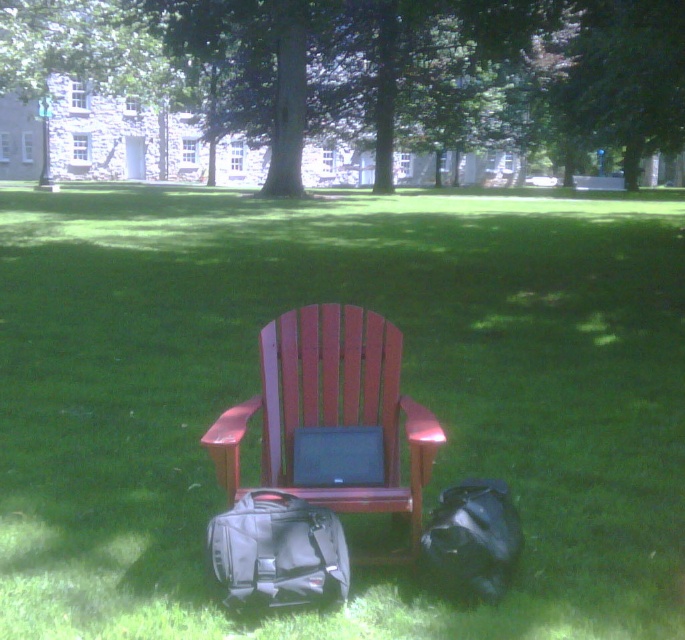
You are a student who wants to place a 30 feet long banner between the green grass at center and the green leafy tree at upper center. Can you fit the banner between them?

The distance between the green grass at center and the green leafy tree at upper center is 28.92 feet. Since the banner is 30 feet long, it is longer than the available distance, so the banner cannot be placed between them.

You are standing at the center of the image and want to pick up the black fabric backpack at lower left. Which direction should you move to reach it?

The black fabric backpack at lower left is located at point (x=277, y=552), so you should move to the lower left direction to reach it.